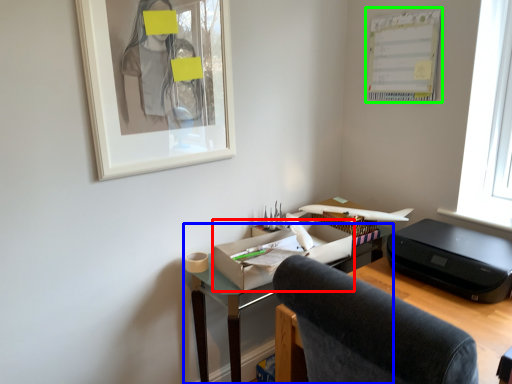
Question: Estimate the real-world distances between objects in this image. Which object is farther from office supplies (highlighted by a red box), desk (highlighted by a blue box) or bulletin board (highlighted by a green box)?

Choices:
 (A) desk
 (B) bulletin board

Answer: (B)